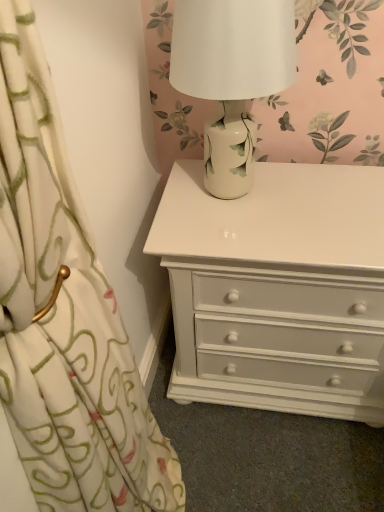
The width and height of the screenshot is (384, 512). In order to click on vacant space in front of white ceramic lamp at upper center in this screenshot , I will do `click(258, 239)`.